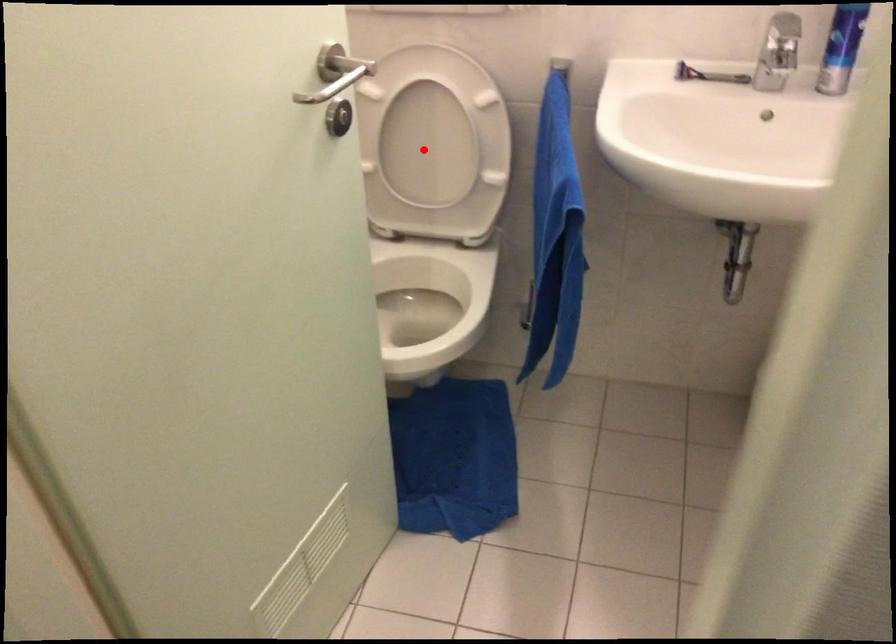
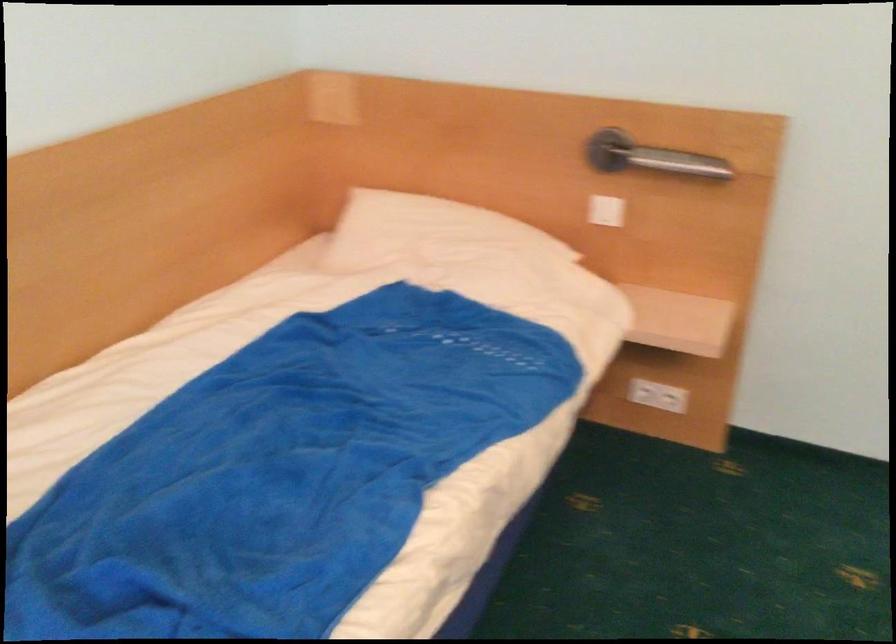
Question: I am providing you with two images of the same scene from different viewpoints. A red point is marked on the first image. At the location where the point appears in image 1, is it still visible in image 2?

Choices:
 (A) Yes
 (B) No

Answer: (B)